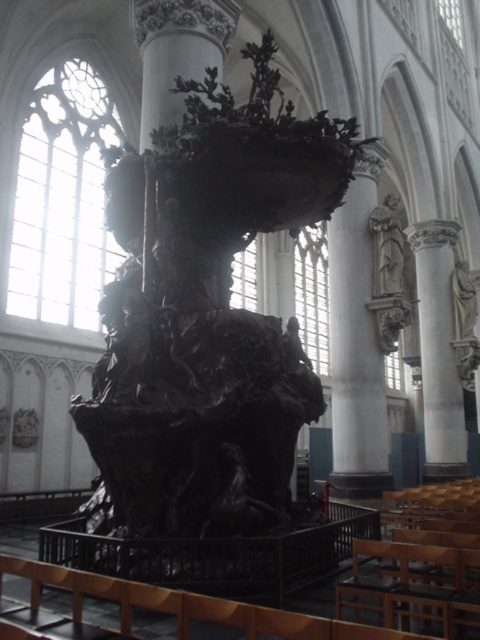
Question: Can you confirm if white marble statue at right is bigger than polished stone statue at right?

Choices:
 (A) yes
 (B) no

Answer: (A)

Question: Is white marble statue at right in front of polished stone statue at right?

Choices:
 (A) yes
 (B) no

Answer: (B)

Question: Which is nearer to the white marble statue at right?

Choices:
 (A) white marble statue at center
 (B) polished stone statue at right

Answer: (B)

Question: Considering the real-world distances, which object is farthest from the white marble statue at right?

Choices:
 (A) white marble statue at center
 (B) polished stone statue at right

Answer: (A)

Question: Is white marble statue at center thinner than white marble statue at right?

Choices:
 (A) no
 (B) yes

Answer: (B)

Question: Which point appears farthest from the camera in this image?

Choices:
 (A) (433, 236)
 (B) (396, 216)
 (C) (361, 273)

Answer: (A)